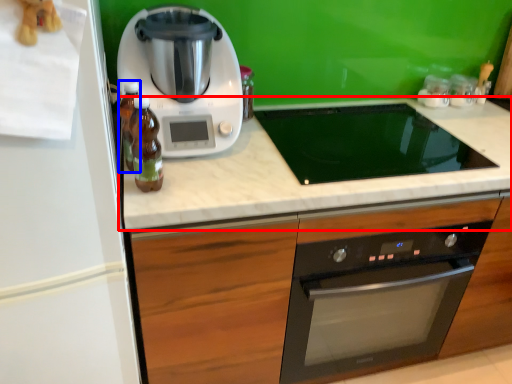
Question: Among these objects, which one is nearest to the camera, countertop (highlighted by a red box) or bottle (highlighted by a blue box)?

Choices:
 (A) countertop
 (B) bottle

Answer: (B)